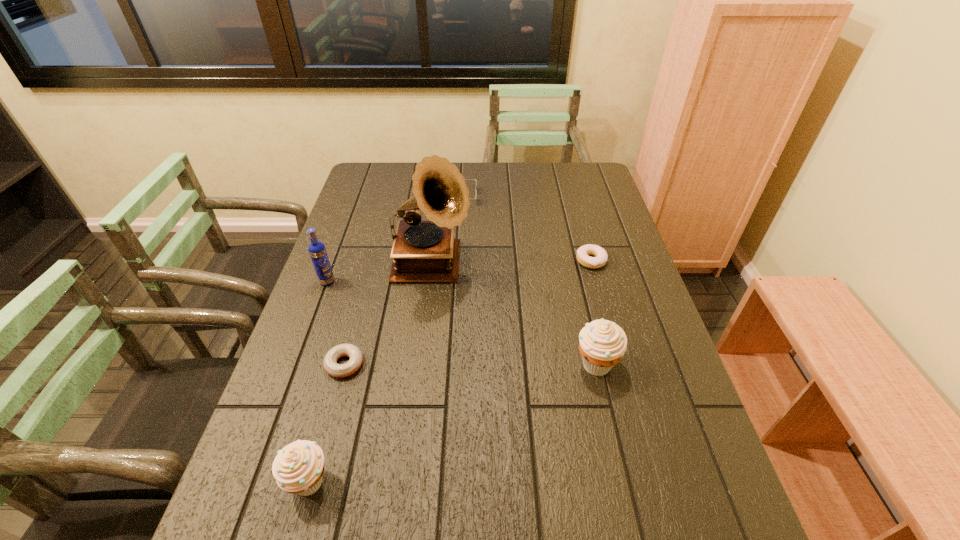
Locate an element on the screen. Image resolution: width=960 pixels, height=540 pixels. free space at the near right corner of the desktop is located at coordinates (697, 495).

Where is `vacant area that lies between the vodka and the right doughnut`? The image size is (960, 540). vacant area that lies between the vodka and the right doughnut is located at coordinates (459, 271).

Locate an element on the screen. The image size is (960, 540). free space between the farther muffin and the right doughnut is located at coordinates (593, 312).

Locate an element on the screen. The width and height of the screenshot is (960, 540). free space between the left muffin and the vodka is located at coordinates (318, 382).

Where is `vacant region between the tallest object and the fifth shortest object`? vacant region between the tallest object and the fifth shortest object is located at coordinates (514, 315).

In order to click on free point between the sunglasses and the farther doughnut in this screenshot , I will do `click(526, 229)`.

Identify the location of empty location between the left muffin and the right doughnut. (450, 372).

This screenshot has height=540, width=960. Identify the location of empty space between the nearer doughnut and the left muffin. (327, 423).

Find the location of a particular element. Image resolution: width=960 pixels, height=540 pixels. vacant point located between the tallest object and the nearer doughnut is located at coordinates (388, 315).

What are the coordinates of `free space between the farther doughnut and the left doughnut` in the screenshot? It's located at (468, 313).